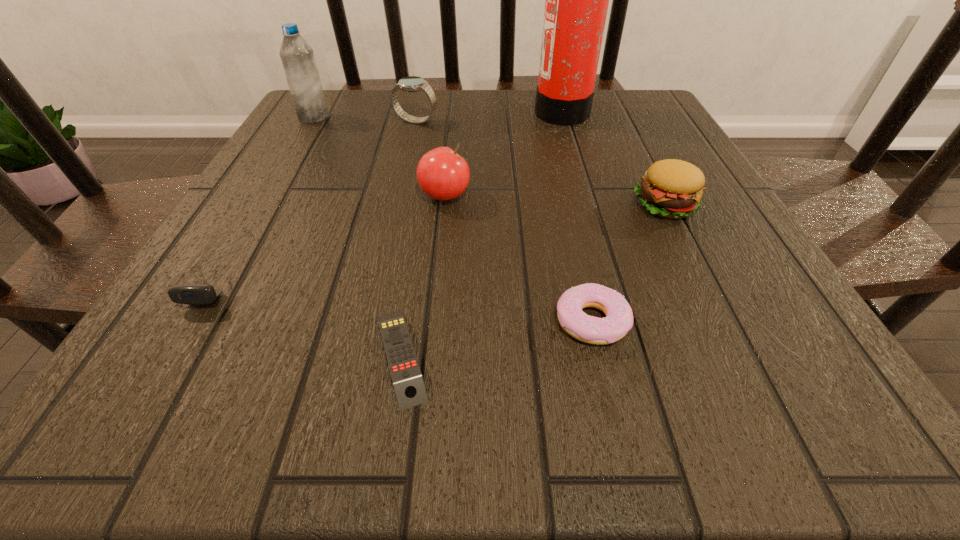
Find the location of a particular element. The image size is (960, 540). free space at the right edge of the desktop is located at coordinates (692, 247).

In the image, there is a desktop. What are the coordinates of `free space at the far left corner` in the screenshot? It's located at (290, 119).

In the image, there is a desktop. At what (x,y) coordinates should I click in order to perform the action: click on vacant space at the near left corner. Please return your answer as a coordinate pair (x, y). Looking at the image, I should click on (246, 402).

Where is `vacant space at the far right corner`? This screenshot has height=540, width=960. vacant space at the far right corner is located at coordinates (623, 91).

Identify the location of free region at the near right corner of the desktop. (729, 377).

Where is `vacant space that is in between the apple and the second tallest object`? Image resolution: width=960 pixels, height=540 pixels. vacant space that is in between the apple and the second tallest object is located at coordinates (379, 157).

At what (x,y) coordinates should I click in order to perform the action: click on free point between the hamburger and the remote control. Please return your answer as a coordinate pair (x, y). The width and height of the screenshot is (960, 540). Looking at the image, I should click on (533, 280).

Locate an element on the screen. vacant region between the webcam and the remote control is located at coordinates (310, 312).

Find the location of a particular element. The width and height of the screenshot is (960, 540). free spot between the doughnut and the water bottle is located at coordinates (453, 219).

Where is `empty location between the tallest object and the apple`? The image size is (960, 540). empty location between the tallest object and the apple is located at coordinates (503, 153).